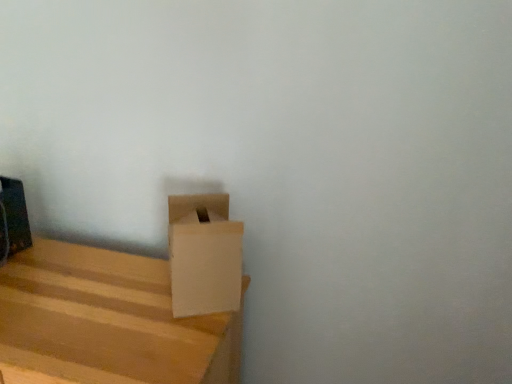
Question: Is the surface of white cardboard box at lower left in direct contact with light brown wood box at lower left?

Choices:
 (A) no
 (B) yes

Answer: (A)

Question: Considering the relative sizes of white cardboard box at lower left and light brown wood box at lower left in the image provided, is white cardboard box at lower left taller than light brown wood box at lower left?

Choices:
 (A) no
 (B) yes

Answer: (A)

Question: Is white cardboard box at lower left not close to light brown wood box at lower left?

Choices:
 (A) no
 (B) yes

Answer: (A)

Question: From the image's perspective, is white cardboard box at lower left on top of light brown wood box at lower left?

Choices:
 (A) yes
 (B) no

Answer: (A)

Question: From the image's perspective, is white cardboard box at lower left under light brown wood box at lower left?

Choices:
 (A) yes
 (B) no

Answer: (B)

Question: Can you confirm if white cardboard box at lower left is thinner than light brown wood box at lower left?

Choices:
 (A) no
 (B) yes

Answer: (B)

Question: Is light brown wood box at lower left completely or partially outside of white cardboard box at lower left?

Choices:
 (A) no
 (B) yes

Answer: (B)

Question: Does light brown wood box at lower left appear on the right side of white cardboard box at lower left?

Choices:
 (A) yes
 (B) no

Answer: (B)

Question: From a real-world perspective, does light brown wood box at lower left stand above white cardboard box at lower left?

Choices:
 (A) no
 (B) yes

Answer: (A)

Question: Is light brown wood box at lower left thinner than white cardboard box at lower left?

Choices:
 (A) no
 (B) yes

Answer: (A)

Question: Is light brown wood box at lower left aimed at white cardboard box at lower left?

Choices:
 (A) yes
 (B) no

Answer: (B)

Question: Is light brown wood box at lower left far from white cardboard box at lower left?

Choices:
 (A) yes
 (B) no

Answer: (B)

Question: Is light brown wood box at lower left wider or thinner than white cardboard box at lower left?

Choices:
 (A) wide
 (B) thin

Answer: (A)